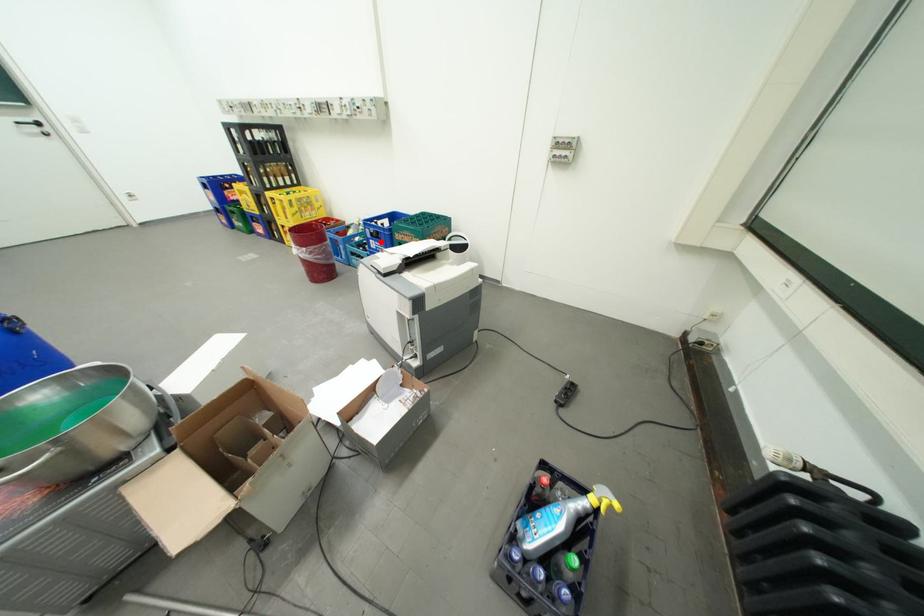
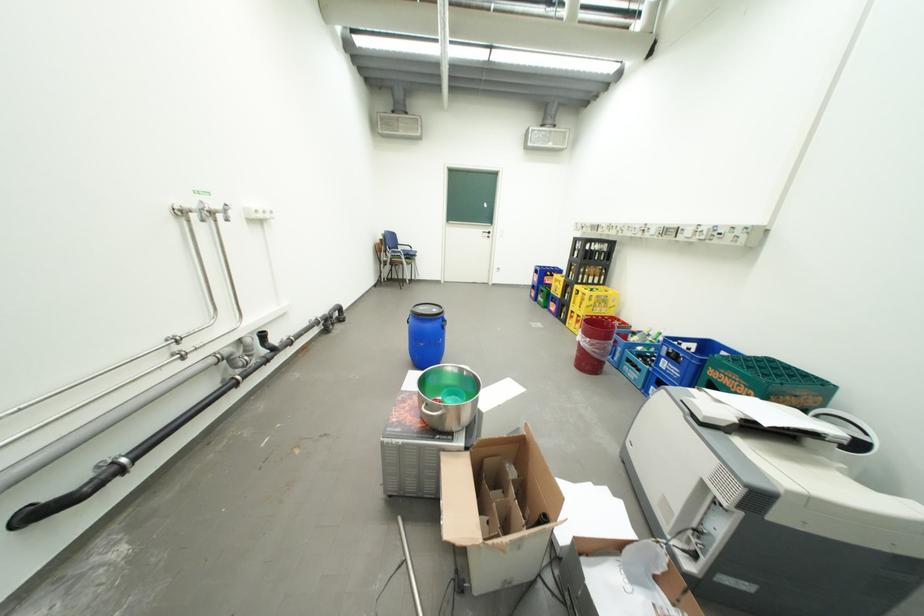
Question: I am providing you with two images of the same scene from different viewpoints. Given a red point in image1, look at the same physical point in image2. Is it:

Choices:
 (A) Closer to the viewpoint
 (B) Farther from the viewpoint

Answer: (A)